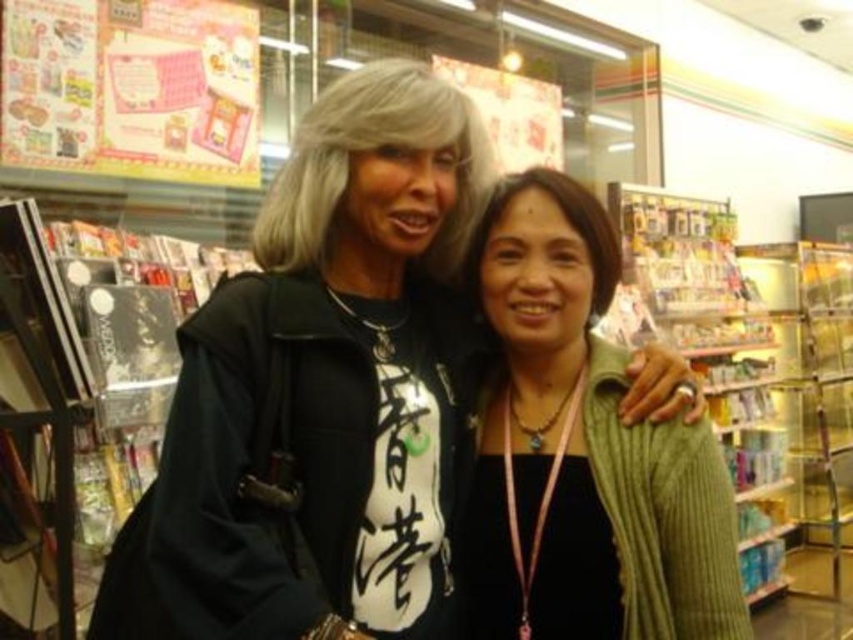
Question: Is matte black jacket at center wider than green knitted sweater at center?

Choices:
 (A) yes
 (B) no

Answer: (A)

Question: Which of the following is the farthest from the observer?

Choices:
 (A) green knitted sweater at center
 (B) matte black jacket at center

Answer: (A)

Question: Does matte black jacket at center have a larger size compared to green knitted sweater at center?

Choices:
 (A) no
 (B) yes

Answer: (B)

Question: Which point is closer to the camera?

Choices:
 (A) green knitted sweater at center
 (B) matte black jacket at center

Answer: (B)

Question: Which point appears farthest from the camera in this image?

Choices:
 (A) (265, 282)
 (B) (541, 433)

Answer: (B)

Question: Can you confirm if matte black jacket at center is smaller than green knitted sweater at center?

Choices:
 (A) yes
 (B) no

Answer: (B)